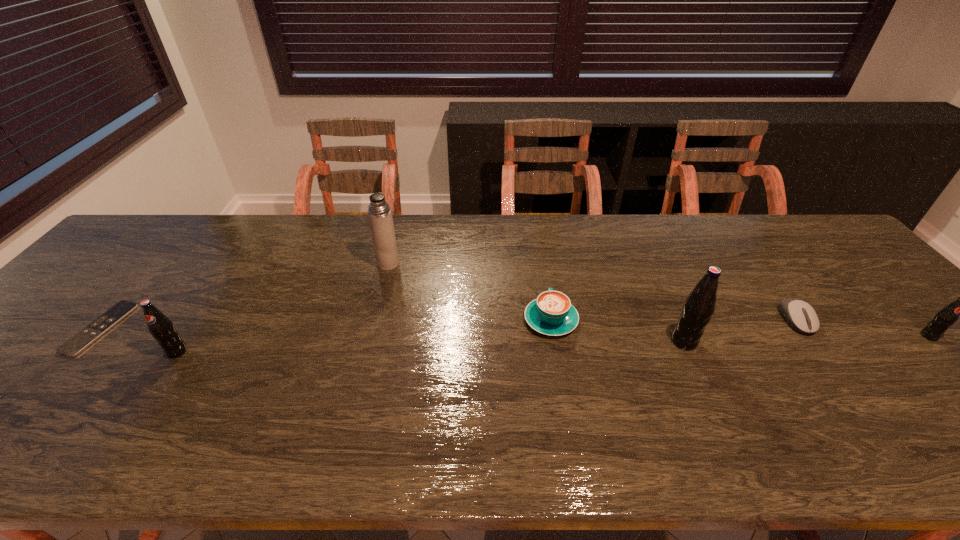
The image size is (960, 540). Identify the location of free spot between the cappuccino and the farthest object. (469, 292).

Locate which object is the second closest to the second shortest pop. Please provide its 2D coordinates. Your answer should be formatted as a tuple, i.e. [(x, y)], where the tuple contains the x and y coordinates of a point satisfying the conditions above.

[(379, 213)]

Where is `the second closest object relative to the fifth object from left to right`? the second closest object relative to the fifth object from left to right is located at coordinates click(x=800, y=315).

Image resolution: width=960 pixels, height=540 pixels. I want to click on pop that is the nearest to the tallest pop, so click(x=946, y=317).

Select which pop is the second closest to the third shortest object. Please provide its 2D coordinates. Your answer should be formatted as a tuple, i.e. [(x, y)], where the tuple contains the x and y coordinates of a point satisfying the conditions above.

[(162, 329)]

Where is `vacant space that satisfies the following two spatial constraints: 1. on the front label of the fourth tallest object; 2. on the front label of the tallest pop`? vacant space that satisfies the following two spatial constraints: 1. on the front label of the fourth tallest object; 2. on the front label of the tallest pop is located at coordinates (934, 341).

Where is `free region that satisfies the following two spatial constraints: 1. on the wheel side of the second shortest object; 2. on the front label of the third object from right to left`? free region that satisfies the following two spatial constraints: 1. on the wheel side of the second shortest object; 2. on the front label of the third object from right to left is located at coordinates (811, 341).